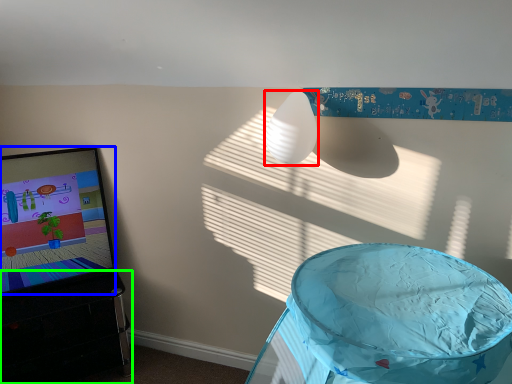
Question: Estimate the real-world distances between objects in this image. Which object is farther from lamp (highlighted by a red box), computer screen (highlighted by a blue box) or furniture (highlighted by a green box)?

Choices:
 (A) computer screen
 (B) furniture

Answer: (B)